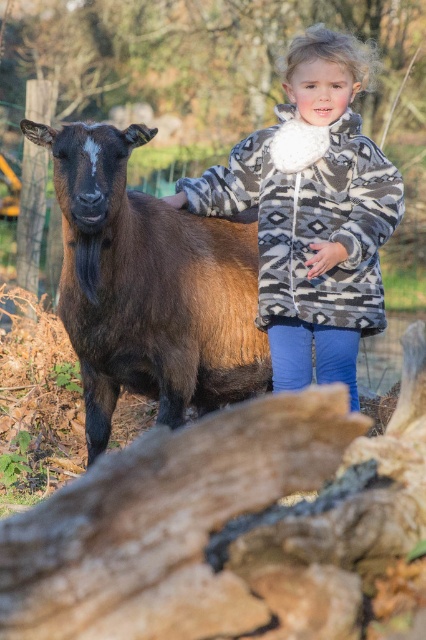
Does brown fuzzy goat at left come in front of patterned fleece jacket at center?

Yes, it is.

Does point (109, 230) lie in front of point (316, 365)?

Yes.

The height and width of the screenshot is (640, 426). Identify the location of brown fuzzy goat at left. (149, 288).